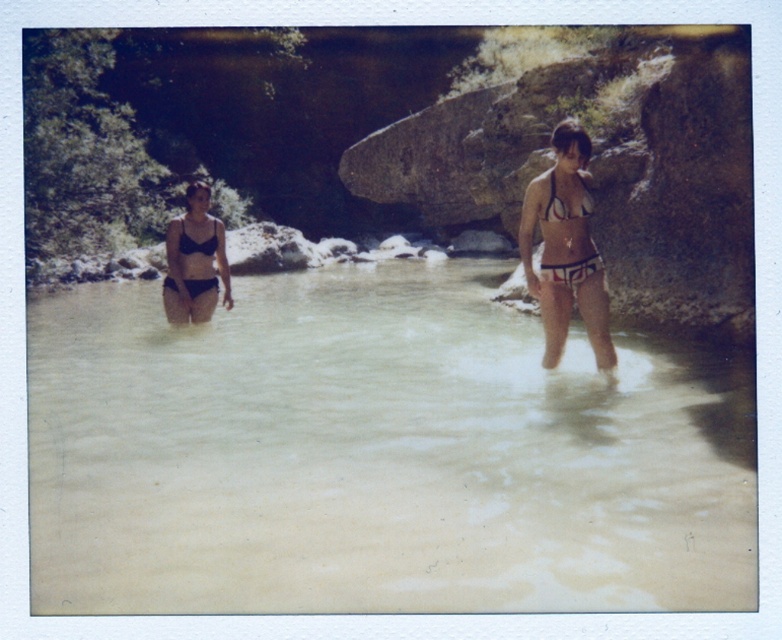
Does clear water at center appear under white matte bikini at right?

Yes.

What do you see at coordinates (375, 456) in the screenshot? The height and width of the screenshot is (640, 782). I see `clear water at center` at bounding box center [375, 456].

I want to click on clear water at center, so click(375, 456).

Who is positioned more to the right, white matte bikini at right or matte black bikini at center?

From the viewer's perspective, white matte bikini at right appears more on the right side.

Who is more distant from viewer, (x=544, y=276) or (x=181, y=230)?

Positioned behind is point (x=181, y=230).

Is point (551, 282) positioned in front of point (189, 288)?

That is True.

What are the coordinates of `white matte bikini at right` in the screenshot? It's located at (571, 269).

Can you confirm if white bikini at center is taller than matte black bikini top at upper right?

Yes, white bikini at center is taller than matte black bikini top at upper right.

Which is behind, point (526, 188) or point (576, 212)?

The point (526, 188) is behind.

The height and width of the screenshot is (640, 782). In order to click on white bikini at center in this screenshot , I will do `click(565, 248)`.